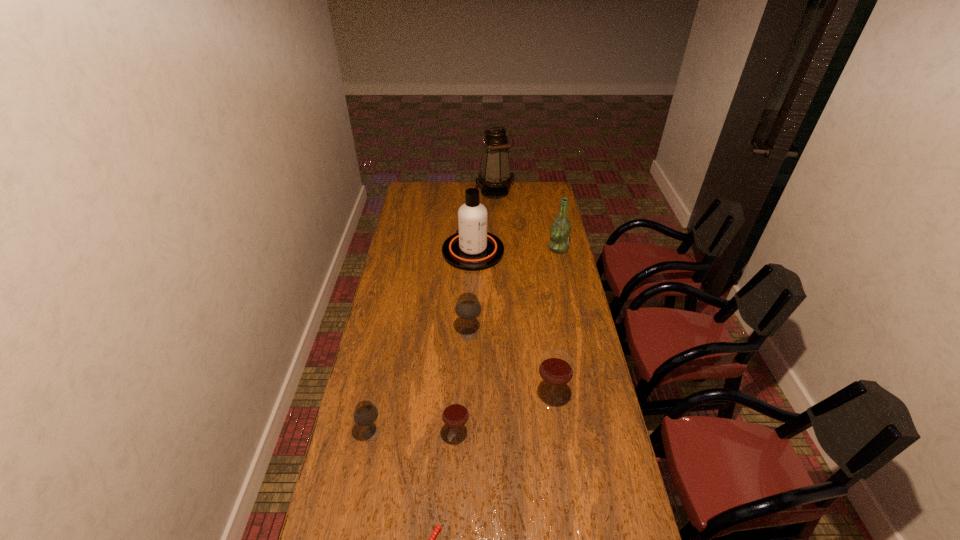
The height and width of the screenshot is (540, 960). In order to click on free region located 0.200m on the left of the right gray wineglass in this screenshot , I will do `click(408, 334)`.

Where is `blank space located 0.200m on the back of the nearer red wineglass`? This screenshot has height=540, width=960. blank space located 0.200m on the back of the nearer red wineglass is located at coordinates (460, 376).

Locate an element on the screen. vacant space situated 0.050m on the back of the leftmost object is located at coordinates (376, 410).

What are the coordinates of `object located at the far edge` in the screenshot? It's located at [x=495, y=175].

I want to click on object located in the left edge section of the desktop, so click(365, 413).

You are a GUI agent. You are given a task and a screenshot of the screen. Output one action in this format:
    pyautogui.click(x=<x>, y=<y>)
    Task: Click on the beer bottle at the right edge
    The height and width of the screenshot is (540, 960).
    Given the screenshot: What is the action you would take?
    (560, 230)

The width and height of the screenshot is (960, 540). In order to click on wineglass located in the right edge section of the desktop in this screenshot , I will do `click(556, 367)`.

In the image, there is a desktop. At what (x,y) coordinates should I click in order to perform the action: click on vacant space at the far edge. Please return your answer as a coordinate pair (x, y). Looking at the image, I should click on (513, 187).

Locate an element on the screen. vacant space at the left edge of the desktop is located at coordinates (408, 319).

Identify the location of vacant space at the right edge of the desktop. This screenshot has height=540, width=960. (617, 462).